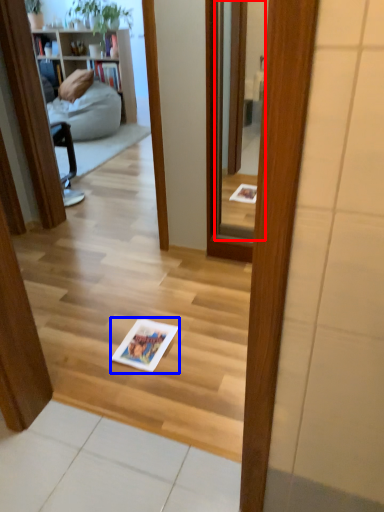
Question: Which object appears closest to the camera in this image, mirror (highlighted by a red box) or book (highlighted by a blue box)?

Choices:
 (A) mirror
 (B) book

Answer: (B)